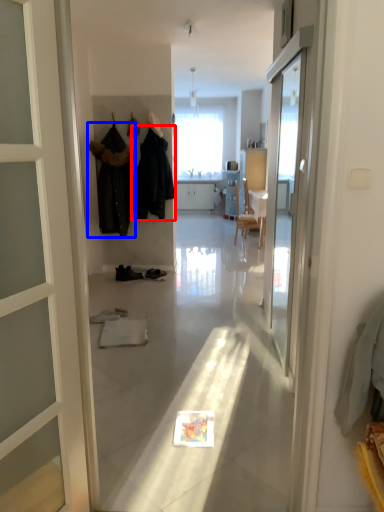
Question: Which of the following is the farthest to the observer, clothing (highlighted by a red box) or clothing (highlighted by a blue box)?

Choices:
 (A) clothing
 (B) clothing

Answer: (B)